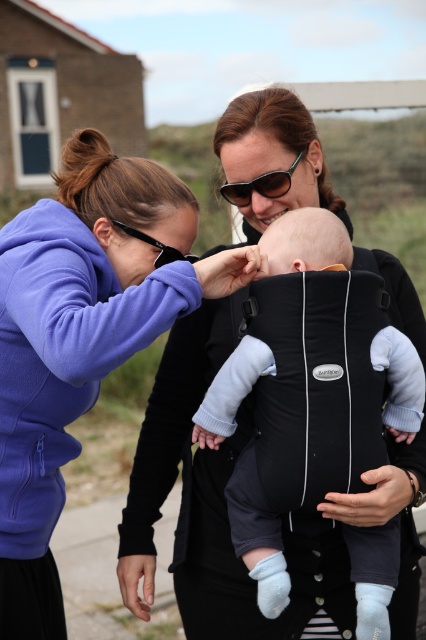
You are standing at the point with coordinates point (241, 192) and want to walk to the point with coordinates point (176, 253). According to the scene description, will you have to walk towards the foreground or the background?

You will have to walk towards the foreground because point (241, 192) is behind point (176, 253), so moving towards it means going forward towards the foreground.

You are a photographer trying to capture a closeup of the baby in the black fabric carrier at center. However, the purple fleece sweatshirt at left is blocking your view. Can you adjust your position to see the baby clearly?

The purple fleece sweatshirt at left is positioned over the black fabric carrier at center, so moving to the right or left slightly might allow you to see around the obstruction.

Based on the photo, you are a photographer setting up a camera to capture the scene. The purple fleece sweatshirt at left and the black fabric carrier at center are in your frame. Which object is narrower when viewed from your camera angle?

The purple fleece sweatshirt at left is thinner than the black fabric carrier at center, so the purple fleece sweatshirt at left is narrower when viewed from the camera angle.